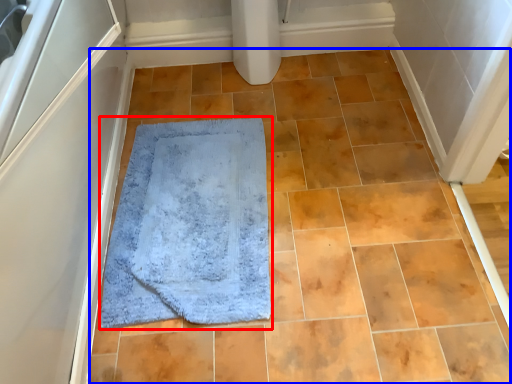
Question: Which object appears closest to the camera in this image, bath mat (highlighted by a red box) or ceramic tile (highlighted by a blue box)?

Choices:
 (A) bath mat
 (B) ceramic tile

Answer: (B)